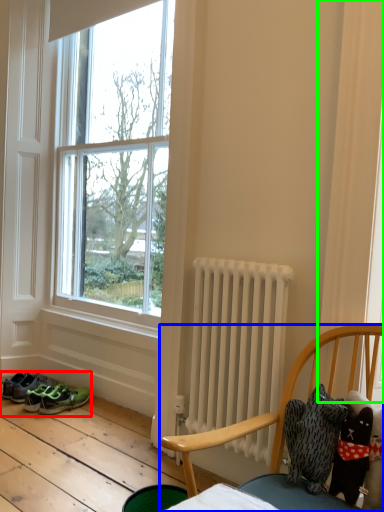
Question: Which object is positioned closest to footwear (highlighted by a red box)? Select from chair (highlighted by a blue box) and curtain (highlighted by a green box).

Choices:
 (A) chair
 (B) curtain

Answer: (A)